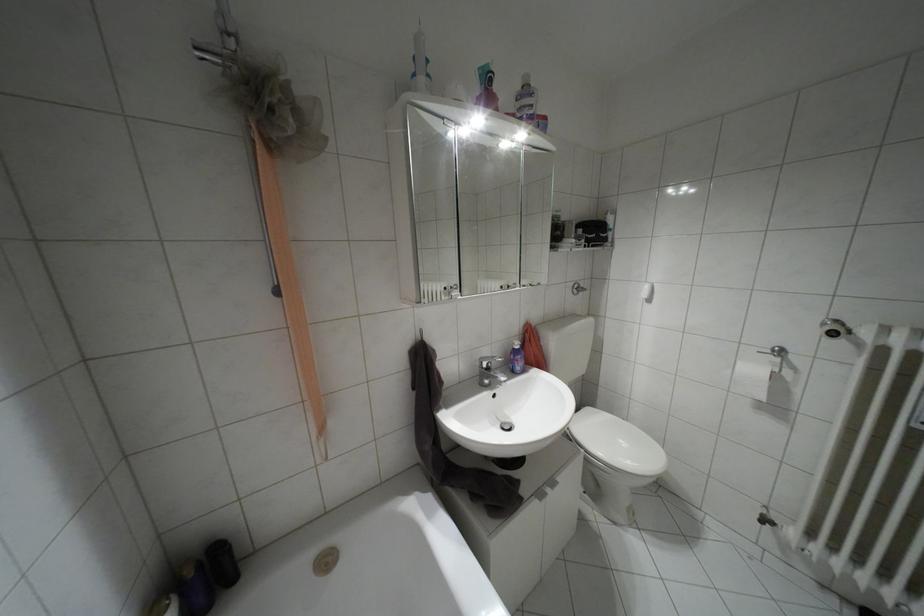
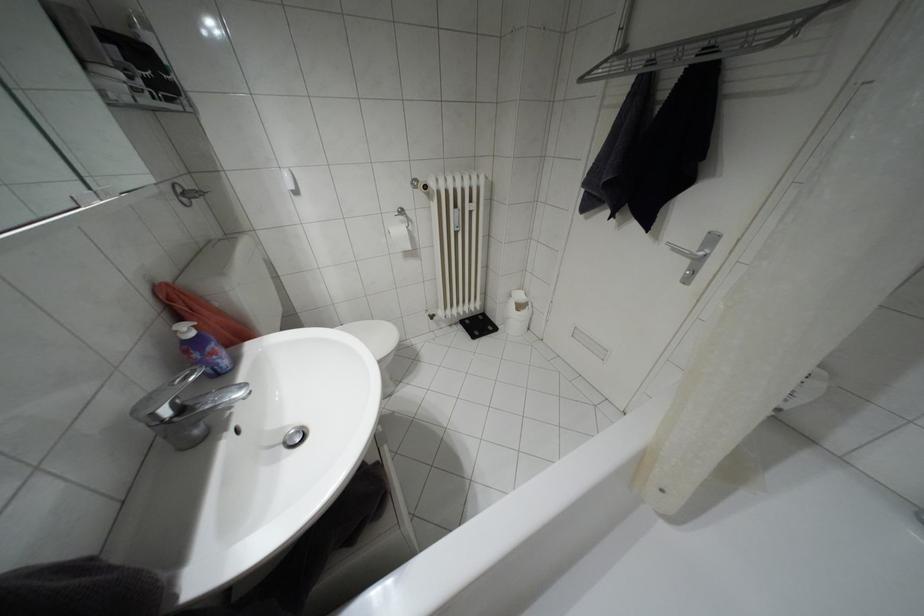
In the second image, find the point that corresponds to (517,346) in the first image.

(190, 333)